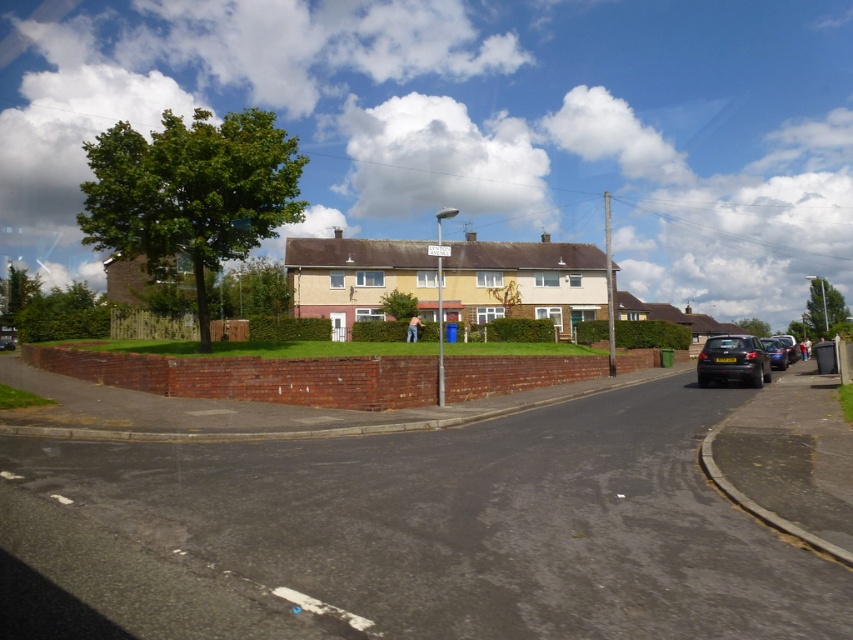
You are a delivery driver who needs to park your vehicle between the shiny black car at lower right and the shiny metallic car at right. Considering their heights, which car should you position your vehicle closer to to ensure enough clearance for your delivery truck?

You should position your vehicle closer to the shiny metallic car at right because the shiny black car at lower right is much taller, which may not provide enough clearance for your delivery truck.

You are a delivery driver who needs to park your shiny black car at lower right. The parking spot is located at point (x=733, y=360). Is the car already parked in the correct spot?

Yes, the car is already parked in the correct spot because the point (x=733, y=360) marks the shiny black car at lower right.

You are a delivery person driving a vehicle and need to park in the parking spot near the shiny black car at lower right and the shiny metallic car at right. Which car should you park next to if you want to minimize the space used?

You should park next to the shiny black car at lower right because it occupies less space than the shiny metallic car at right, so parking there would require less space.